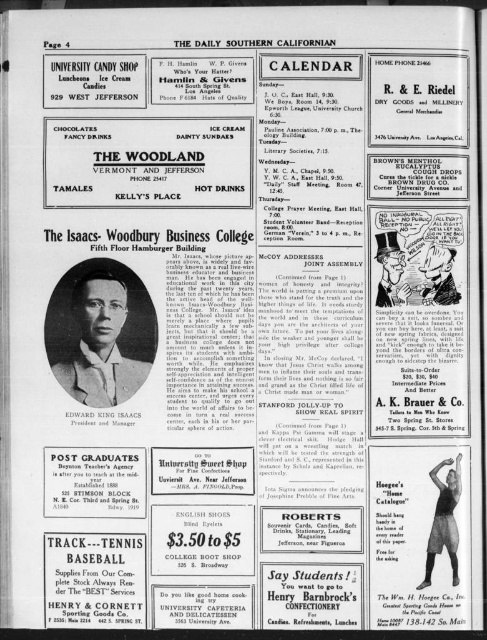
Question: From the image, what is the correct spatial relationship of black paper portrait at center in relation to matte red tie at center?

Choices:
 (A) above
 (B) below

Answer: (B)

Question: Which is farther from the matte red tie at center?

Choices:
 (A) black paper portrait at center
 (B) black fabric mannequin at center

Answer: (A)

Question: Is black fabric mannequin at center closer to the viewer compared to matte red tie at center?

Choices:
 (A) no
 (B) yes

Answer: (B)

Question: Which point is farther from the camera taking this photo?

Choices:
 (A) [x=81, y=300]
 (B) [x=431, y=528]

Answer: (A)

Question: Estimate the real-world distances between objects in this image. Which object is closer to the matte red tie at center?

Choices:
 (A) black fabric mannequin at center
 (B) black paper portrait at center

Answer: (A)

Question: Does black paper portrait at center lie in front of black fabric mannequin at center?

Choices:
 (A) no
 (B) yes

Answer: (A)